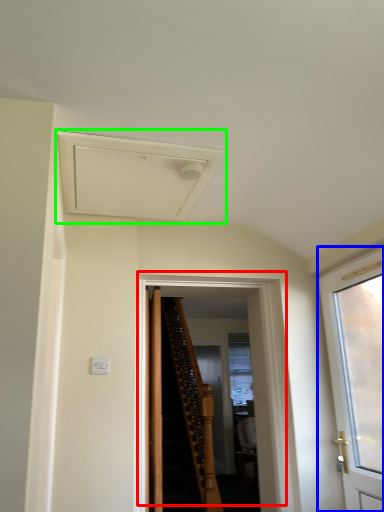
Question: Estimate the real-world distances between objects in this image. Which object is closer to door (highlighted by a red box), door (highlighted by a blue box) or exhaust hood (highlighted by a green box)?

Choices:
 (A) door
 (B) exhaust hood

Answer: (A)